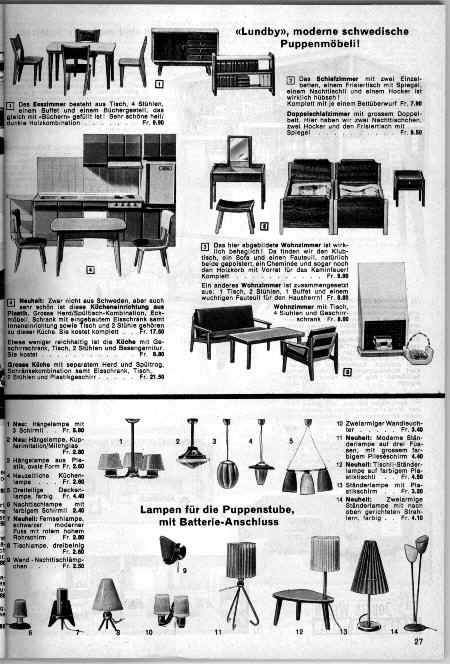
This screenshot has width=450, height=664. What are the coordinates of `tables` in the screenshot? It's located at (309, 596), (262, 334), (237, 169), (406, 175), (75, 222), (103, 46).